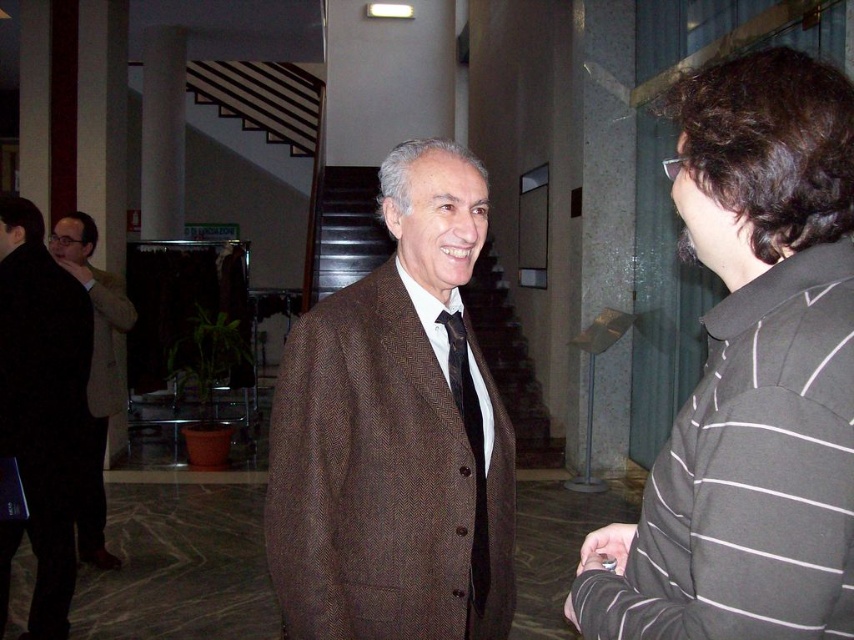
Does matte black suit at left appear on the left side of black silk tie at center?

Yes, matte black suit at left is to the left of black silk tie at center.

In the scene shown: Does matte black suit at left have a greater height compared to black silk tie at center?

Yes.

The width and height of the screenshot is (854, 640). Identify the location of matte black suit at left. (39, 410).

Identify the location of matte black suit at left. The height and width of the screenshot is (640, 854). 39,410.

Between black striped shirt at right and matte brown suit at left, which one appears on the right side from the viewer's perspective?

From the viewer's perspective, black striped shirt at right appears more on the right side.

Does black striped shirt at right have a greater height compared to matte brown suit at left?

In fact, black striped shirt at right may be shorter than matte brown suit at left.

What are the coordinates of `black striped shirt at right` in the screenshot? It's located at (752, 378).

Between point (724, 387) and point (458, 376), which one is positioned behind?

Point (458, 376)

Does point (648, 604) come behind point (471, 588)?

That is False.

You are a GUI agent. You are given a task and a screenshot of the screen. Output one action in this format:
    pyautogui.click(x=<x>, y=<y>)
    Task: Click on the black striped shirt at right
    The height and width of the screenshot is (640, 854).
    Given the screenshot: What is the action you would take?
    pyautogui.click(x=752, y=378)